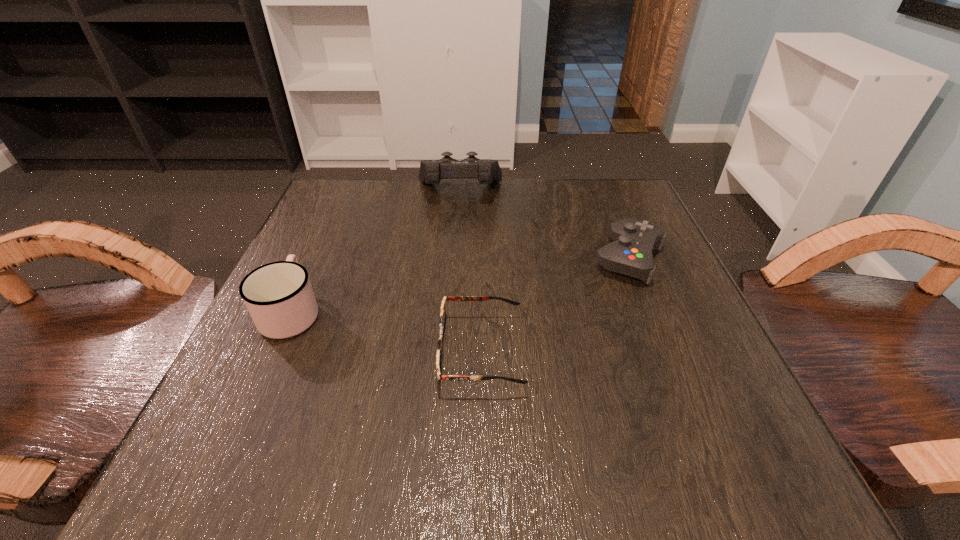
This screenshot has height=540, width=960. I want to click on free space that satisfies the following two spatial constraints: 1. on the side of the mug with the handle; 2. on the right side of the nearer control, so click(315, 259).